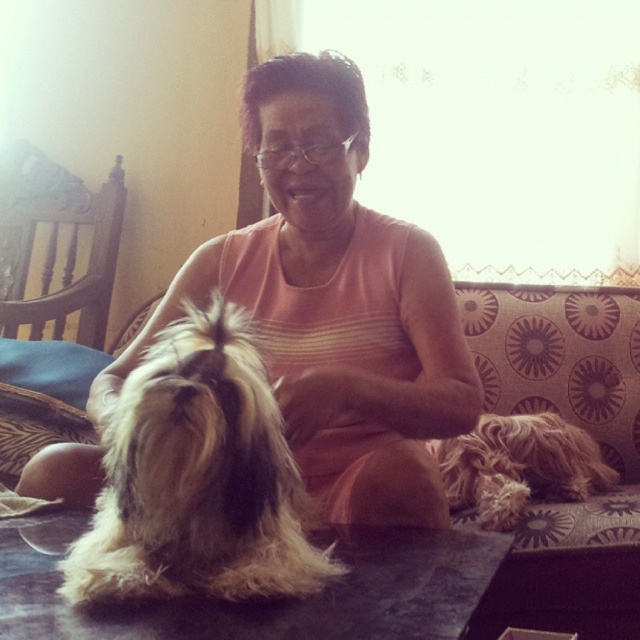
Based on the scene description, can you determine which object is taller between the fuzzy brown dog at center and the patterned fabric couch at center?

The fuzzy brown dog at center is not as tall as the patterned fabric couch at center, so the couch is taller.

You are taking a photo of the scene and want to focus on both the point at point (541, 513) and the point at point (474, 490). Which point should you adjust your focus to first to ensure both are in focus?

You should focus on point (474, 490) first because it is further away from the camera than point (541, 513). By focusing on the further point, the closer point will also be in focus due to the depth of field.